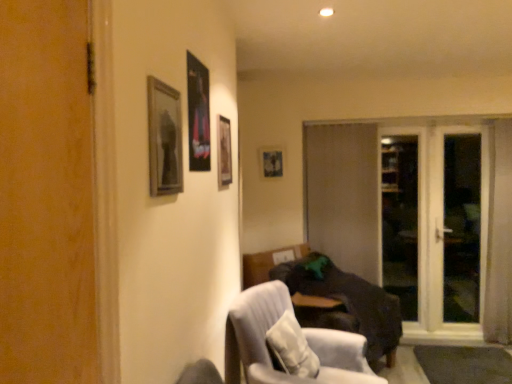
Question: In the image, is wooden picture frame at center, which is the fourth picture frame from left to right, on the left side or the right side of transparent glass screen door at right, placed as the 2th screen door when sorted from left to right?

Choices:
 (A) right
 (B) left

Answer: (B)

Question: Considering the positions of wooden picture frame at center, arranged as the first picture frame when viewed from the right, and transparent glass screen door at right, which is the first screen door in right-to-left order, in the image, is wooden picture frame at center, arranged as the first picture frame when viewed from the right, wider or thinner than transparent glass screen door at right, which is the first screen door in right-to-left order,?

Choices:
 (A) thin
 (B) wide

Answer: (A)

Question: Which object is the closest to the wooden frame at upper left, which ranks as the fourth picture frame in back-to-front order?

Choices:
 (A) brown matte door at center
 (B) wooden picture frame at center, positioned as the 1th picture frame in back-to-front order
 (C) light gray fabric chair at lower center
 (D) white textured pillow at lower center
 (E) wooden frame at upper center, marked as the second picture frame in a right-to-left arrangement

Answer: (E)

Question: Which object is the closest to the wooden frame at upper left, the fourth picture frame positioned from the right?

Choices:
 (A) metallic poster at upper center, positioned as the 2th picture frame in left-to-right order
 (B) light gray fabric chair at lower center
 (C) transparent glass screen door at right, placed as the 2th screen door when sorted from left to right
 (D) dark brown fabric couch at lower right
 (E) transparent glass screen door at right, which ranks as the 2th screen door in right-to-left order

Answer: (A)